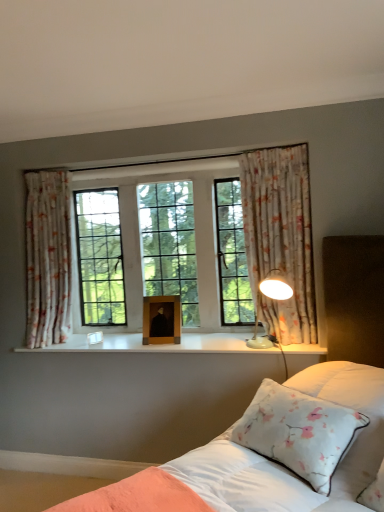
Question: Is white glossy wood at center smaller than floral fabric curtain at right, positioned as the 1th curtain in right-to-left order?

Choices:
 (A) no
 (B) yes

Answer: (B)

Question: From the image's perspective, is white glossy wood at center located above floral fabric curtain at right, which ranks as the 2th curtain in back-to-front order?

Choices:
 (A) no
 (B) yes

Answer: (A)

Question: Does white glossy wood at center come in front of floral fabric curtain at right, the first curtain when ordered from front to back?

Choices:
 (A) yes
 (B) no

Answer: (A)

Question: From a real-world perspective, is white glossy wood at center below floral fabric curtain at right, positioned as the 2th curtain in left-to-right order?

Choices:
 (A) no
 (B) yes

Answer: (B)

Question: Is white glossy wood at center positioned beyond the bounds of floral fabric curtain at right, which ranks as the 2th curtain in back-to-front order?

Choices:
 (A) yes
 (B) no

Answer: (A)

Question: From a real-world perspective, relative to white satin bed at center, is floral fabric curtain at left, placed as the 1th curtain when sorted from left to right, vertically above or below?

Choices:
 (A) below
 (B) above

Answer: (B)

Question: Is floral fabric curtain at left, placed as the 2th curtain when sorted from right to left, wider or thinner than white satin bed at center?

Choices:
 (A) wide
 (B) thin

Answer: (B)

Question: From the image's perspective, is floral fabric curtain at left, which is the second curtain in front-to-back order, located above or below white satin bed at center?

Choices:
 (A) above
 (B) below

Answer: (A)

Question: Is point (44, 309) closer or farther from the camera than point (327, 334)?

Choices:
 (A) farther
 (B) closer

Answer: (A)

Question: From their relative heights in the image, would you say wooden picture frame at center is taller or shorter than white glossy table lamp at right?

Choices:
 (A) tall
 (B) short

Answer: (B)

Question: In the image, is wooden picture frame at center positioned in front of or behind white glossy table lamp at right?

Choices:
 (A) front
 (B) behind

Answer: (B)

Question: Looking at their shapes, would you say wooden picture frame at center is wider or thinner than white glossy table lamp at right?

Choices:
 (A) thin
 (B) wide

Answer: (A)

Question: Is point (155, 309) closer or farther from the camera than point (274, 296)?

Choices:
 (A) closer
 (B) farther

Answer: (B)

Question: Is point (44, 346) closer or farther from the camera than point (72, 348)?

Choices:
 (A) farther
 (B) closer

Answer: (A)

Question: Considering the relative positions of floral fabric curtain at left, placed as the 1th curtain when sorted from left to right, and white glossy wood at center in the image provided, is floral fabric curtain at left, placed as the 1th curtain when sorted from left to right, to the left or to the right of white glossy wood at center?

Choices:
 (A) left
 (B) right

Answer: (A)